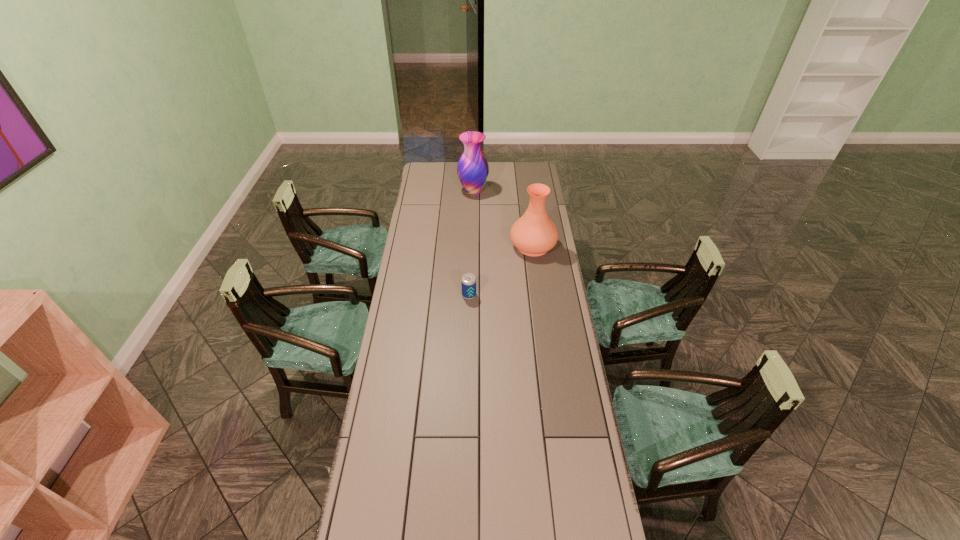
In order to click on the left vase in this screenshot , I will do `click(472, 168)`.

Where is `the farther vase`? the farther vase is located at coordinates (472, 168).

What are the coordinates of `the right vase` in the screenshot? It's located at (533, 234).

This screenshot has height=540, width=960. I want to click on the second farthest object, so click(533, 234).

Where is `beer can`? The width and height of the screenshot is (960, 540). beer can is located at coordinates (468, 282).

Identify the location of the shortest object. (468, 282).

You are a GUI agent. You are given a task and a screenshot of the screen. Output one action in this format:
    pyautogui.click(x=<x>, y=<y>)
    Task: Click on the free space located 0.320m on the front of the left vase
    Image resolution: width=960 pixels, height=540 pixels.
    Given the screenshot: What is the action you would take?
    pyautogui.click(x=472, y=235)

The width and height of the screenshot is (960, 540). In order to click on vacant space located on the back of the right vase in this screenshot , I will do `click(527, 201)`.

Where is `vacant space situated on the front of the shortest object`? The image size is (960, 540). vacant space situated on the front of the shortest object is located at coordinates (468, 314).

Image resolution: width=960 pixels, height=540 pixels. I want to click on object present at the right edge, so click(533, 234).